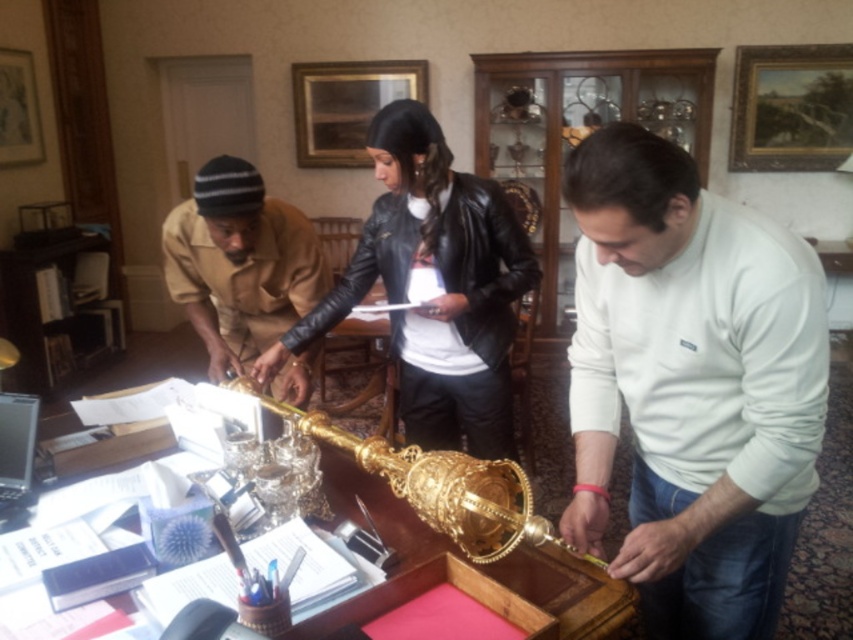
Question: Is white cotton shirt at center to the right of gold polished table at center from the viewer's perspective?

Choices:
 (A) yes
 (B) no

Answer: (A)

Question: Estimate the real-world distances between objects in this image. Which object is closer to the brown leather jacket at center?

Choices:
 (A) white cotton shirt at center
 (B) gold polished table at center
 (C) black leather jacket at center

Answer: (C)

Question: Which of the following is the farthest from the observer?

Choices:
 (A) (401, 404)
 (B) (772, 353)
 (C) (335, 468)
 (D) (271, 257)

Answer: (A)

Question: Is black leather jacket at center above gold polished table at center?

Choices:
 (A) yes
 (B) no

Answer: (A)

Question: Which object is farther from the camera taking this photo?

Choices:
 (A) gold polished table at center
 (B) white cotton shirt at center
 (C) brown leather jacket at center
 (D) black leather jacket at center

Answer: (D)

Question: Does white cotton shirt at center come in front of brown leather jacket at center?

Choices:
 (A) yes
 (B) no

Answer: (A)